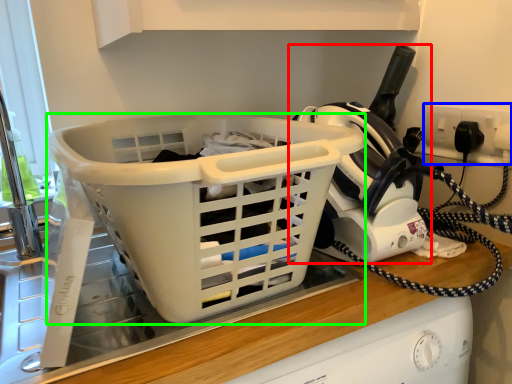
Question: Which is farther away from appliance (highlighted by a red box)? electric outlet (highlighted by a blue box) or basket (highlighted by a green box)?

Choices:
 (A) electric outlet
 (B) basket

Answer: (A)